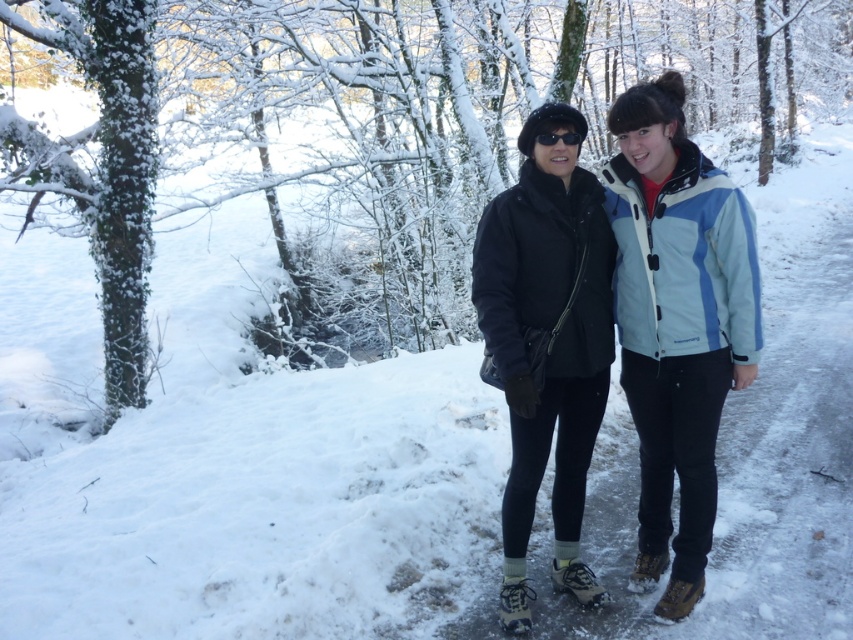
Can you confirm if matte blue jacket at center is shorter than brown suede snowshoe at lower center?

No.

Does matte blue jacket at center appear under brown suede snowshoe at lower center?

No.

Does point (691, 216) come behind point (635, 582)?

No, (691, 216) is closer to viewer.

Identify the location of matte blue jacket at center. Image resolution: width=853 pixels, height=640 pixels. (677, 308).

Describe the element at coordinates (515, 604) in the screenshot. The height and width of the screenshot is (640, 853). I see `white rubber snowshoe at lower center` at that location.

What do you see at coordinates (515, 604) in the screenshot?
I see `white rubber snowshoe at lower center` at bounding box center [515, 604].

Find the location of a particular element. The image size is (853, 640). white rubber snowshoe at lower center is located at coordinates (515, 604).

Is black matte jacket at center bigger than brown leather snowshoe at lower right?

Correct, black matte jacket at center is larger in size than brown leather snowshoe at lower right.

Is black matte jacket at center positioned before brown leather snowshoe at lower right?

Yes, it is in front of brown leather snowshoe at lower right.

Identify the location of black matte jacket at center. (546, 324).

The width and height of the screenshot is (853, 640). I want to click on black matte jacket at center, so click(x=546, y=324).